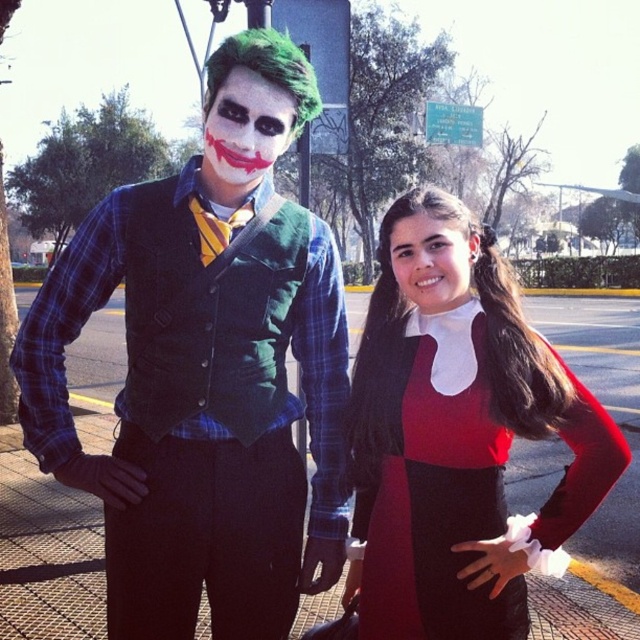
Question: Which of the following is the farthest from the observer?

Choices:
 (A) matte black vest at center
 (B) matte red sweater at center
 (C) matte red dress at center

Answer: (A)

Question: Estimate the real-world distances between objects in this image. Which object is closer to the matte red dress at center?

Choices:
 (A) matte black vest at center
 (B) matte red sweater at center

Answer: (B)

Question: Considering the real-world distances, which object is farthest from the matte red dress at center?

Choices:
 (A) matte red sweater at center
 (B) matte black vest at center

Answer: (B)

Question: Is matte black vest at center wider than matte red dress at center?

Choices:
 (A) yes
 (B) no

Answer: (A)

Question: Is matte red sweater at center above matte red dress at center?

Choices:
 (A) no
 (B) yes

Answer: (B)

Question: Is matte red sweater at center positioned behind matte red dress at center?

Choices:
 (A) yes
 (B) no

Answer: (B)